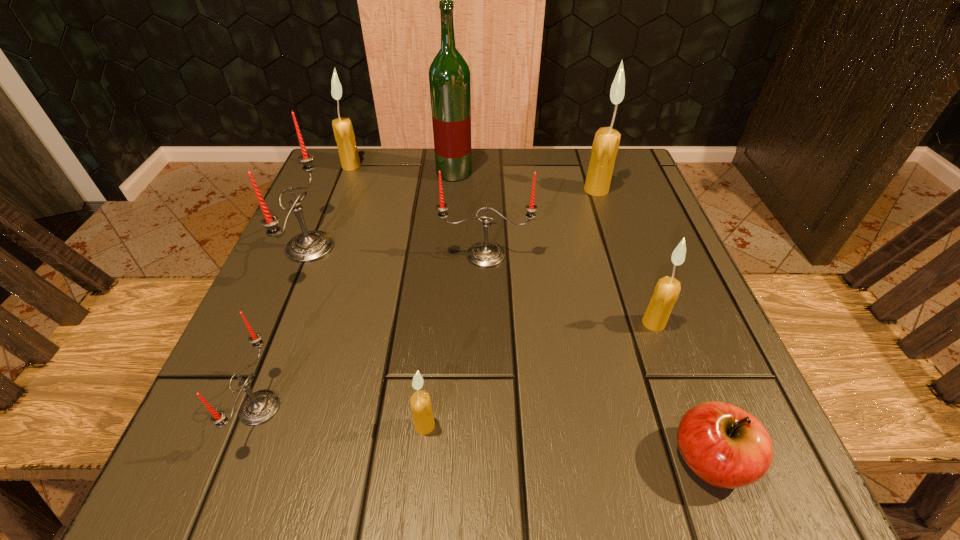
The height and width of the screenshot is (540, 960). In order to click on free space located 0.230m on the right of the smallest cream candle in this screenshot , I will do `click(609, 425)`.

Identify the location of vacant region located 0.170m on the front-facing side of the nearest red candle. (404, 408).

Find the location of a particular element. Image resolution: width=960 pixels, height=540 pixels. vacant region located on the left of the apple is located at coordinates (542, 459).

The height and width of the screenshot is (540, 960). What are the coordinates of `liquor situated at the far edge` in the screenshot? It's located at (449, 76).

Where is `apple that is at the near edge`? This screenshot has width=960, height=540. apple that is at the near edge is located at coordinates (727, 447).

At what (x,y) coordinates should I click in order to perform the action: click on apple located in the right edge section of the desktop. Please return your answer as a coordinate pair (x, y). This screenshot has width=960, height=540. Looking at the image, I should click on (727, 447).

Where is `object located at the far left corner`? The image size is (960, 540). object located at the far left corner is located at coordinates (344, 135).

Locate an element on the screen. object at the near left corner is located at coordinates (259, 407).

This screenshot has width=960, height=540. I want to click on object situated at the far right corner, so click(x=605, y=146).

At what (x,y) coordinates should I click in order to perform the action: click on object that is at the near right corner. Please return your answer as a coordinate pair (x, y). Looking at the image, I should click on (727, 447).